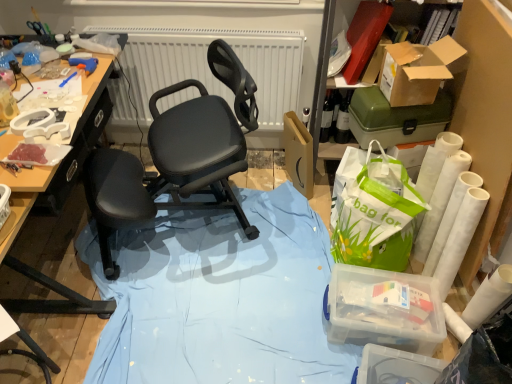
You are a GUI agent. You are given a task and a screenshot of the screen. Output one action in this format:
    pyautogui.click(x=<x>, y=<y>)
    Task: Click on the free spot below blue matte fabric at center (from a real-world perspective)
    The width and height of the screenshot is (512, 384).
    Given the screenshot: What is the action you would take?
    pyautogui.click(x=218, y=308)